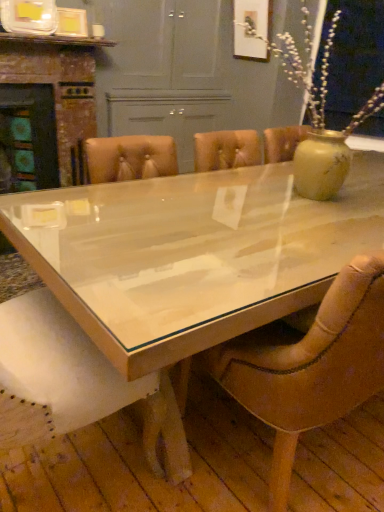
The height and width of the screenshot is (512, 384). Describe the element at coordinates (162, 286) in the screenshot. I see `clear glass table at center` at that location.

Find the location of a particular element. wooden fireplace at left is located at coordinates (46, 110).

This screenshot has width=384, height=512. I want to click on leather at center, so click(x=308, y=365).

From the image's perspective, who appears lower, clear glass table at center or leather at center?

leather at center, from the image's perspective.

From a real-world perspective, relative to leather at center, is clear glass table at center vertically above or below?

clear glass table at center is situated lower than leather at center in the real world.

Who is bigger, clear glass table at center or leather at center?

clear glass table at center is bigger.

Considering their positions, is clear glass table at center located in front of or behind leather at center?

clear glass table at center is in front of leather at center.

Between leather at center and clear glass table at center, which one is positioned behind?

leather at center is further away from the camera.

Who is shorter, leather at center or clear glass table at center?

clear glass table at center is shorter.

Find the location of a particular element. coffee table located in front of the leather at center is located at coordinates (162, 286).

Which is less distant, (265, 333) or (19, 377)?

Point (265, 333) appears to be farther away from the viewer than point (19, 377).

From the image's perspective, is clear glass table at center over wooden fireplace at left?

No, from the image's perspective, clear glass table at center is not above wooden fireplace at left.

I want to click on fireplace behind the clear glass table at center, so click(x=46, y=110).

Can you confirm if clear glass table at center is shorter than wooden fireplace at left?

Yes.

From a real-world perspective, which object rests below the other?

clear glass table at center.

Between wooden fireplace at left and leather at center, which one has larger width?

Wider between the two is leather at center.

Find the location of a particular element. The height and width of the screenshot is (512, 384). chair below the wooden fireplace at left (from a real-world perspective) is located at coordinates (308, 365).

Considering the relative positions of leather at center and wooden fireplace at left in the image provided, is leather at center in front of wooden fireplace at left?

Yes, it is in front of wooden fireplace at left.

Is point (267, 333) closer or farther from the camera than point (79, 114)?

Point (267, 333) appears to be closer to the viewer than point (79, 114).

What's the angular difference between leather at center and wooden fireplace at left's facing directions?

The angular difference between leather at center and wooden fireplace at left is 178 degrees.

Is leather at center to the right of wooden fireplace at left from the viewer's perspective?

Indeed, leather at center is positioned on the right side of wooden fireplace at left.

Does wooden fireplace at left have a larger size compared to clear glass table at center?

No, wooden fireplace at left is not bigger than clear glass table at center.

Is point (74, 54) farther from camera compared to point (161, 237)?

Yes, point (74, 54) is farther from viewer.

Does wooden fireplace at left lie in front of clear glass table at center?

No, wooden fireplace at left is further to the viewer.

Where is `coffee table in front of the leather at center`? This screenshot has height=512, width=384. coffee table in front of the leather at center is located at coordinates (162, 286).

Find the location of a particular element. Image resolution: width=384 pixels, height=512 pixels. chair on the left of clear glass table at center is located at coordinates (308, 365).

From the image, which object appears to be farther from leather at center, clear glass table at center or wooden fireplace at left?

wooden fireplace at left is positioned further to the anchor leather at center.

From the image, which object appears to be farther from clear glass table at center, wooden fireplace at left or leather at center?

→ The object further to clear glass table at center is wooden fireplace at left.

Estimate the real-world distances between objects in this image. Which object is further from leather at center, wooden fireplace at left or clear glass table at center?

wooden fireplace at left is further to leather at center.

Looking at the image, which one is located closer to wooden fireplace at left, clear glass table at center or leather at center?

clear glass table at center is positioned closer to the anchor wooden fireplace at left.

Considering their positions, is leather at center positioned closer to clear glass table at center than wooden fireplace at left?

Among the two, leather at center is located nearer to clear glass table at center.

When comparing their distances from wooden fireplace at left, does leather at center or clear glass table at center seem further?

leather at center is further to wooden fireplace at left.

What are the coordinates of `chair located between clear glass table at center and wooden fireplace at left in the depth direction` in the screenshot? It's located at (308, 365).